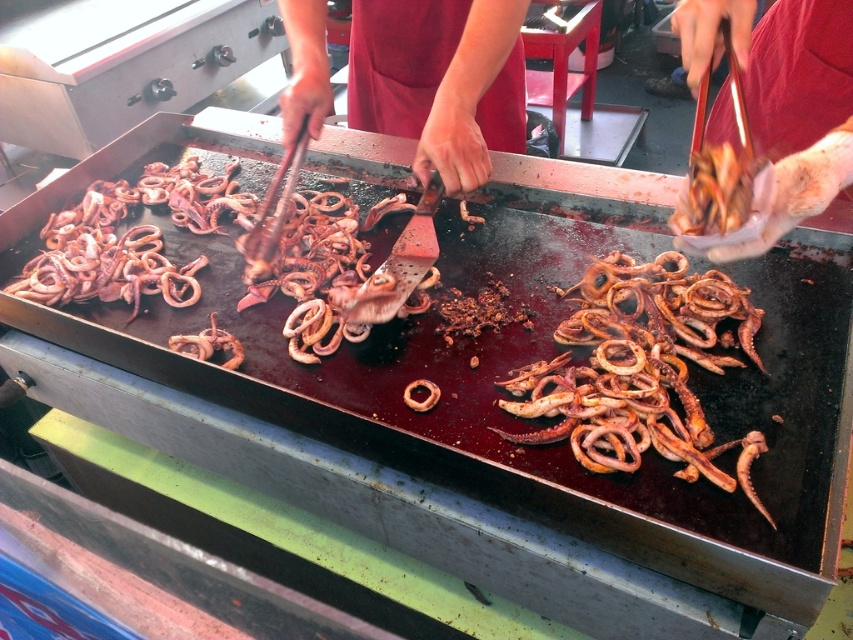
Question: Which of the following is the farthest from the observer?

Choices:
 (A) shiny golden squid at right
 (B) brown rubbery squid at center

Answer: (B)

Question: Which object is the closest to the shiny golden squid at right?

Choices:
 (A) smooth red apron at center
 (B) brown crispy squid at center
 (C) brown rubbery squid at center

Answer: (A)

Question: Is brown rubbery squid at center to the right of shiny golden squid at right from the viewer's perspective?

Choices:
 (A) yes
 (B) no

Answer: (B)

Question: Among these points, which one is nearest to the camera?

Choices:
 (A) (676, 230)
 (B) (746, 54)

Answer: (B)

Question: Can you confirm if brown crispy squid at center is wider than red apron at center?

Choices:
 (A) no
 (B) yes

Answer: (A)

Question: Is smooth red apron at center to the right of red apron at center from the viewer's perspective?

Choices:
 (A) yes
 (B) no

Answer: (A)